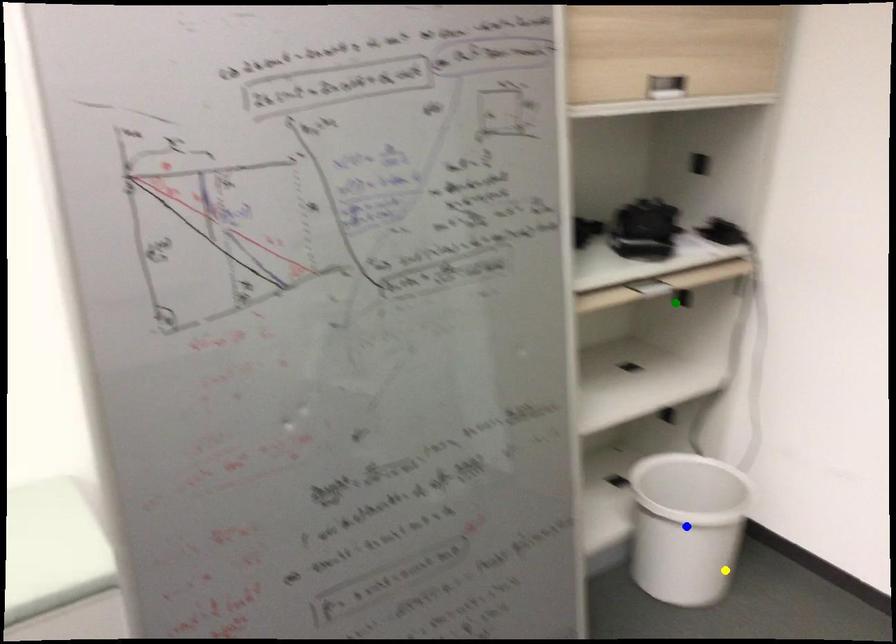
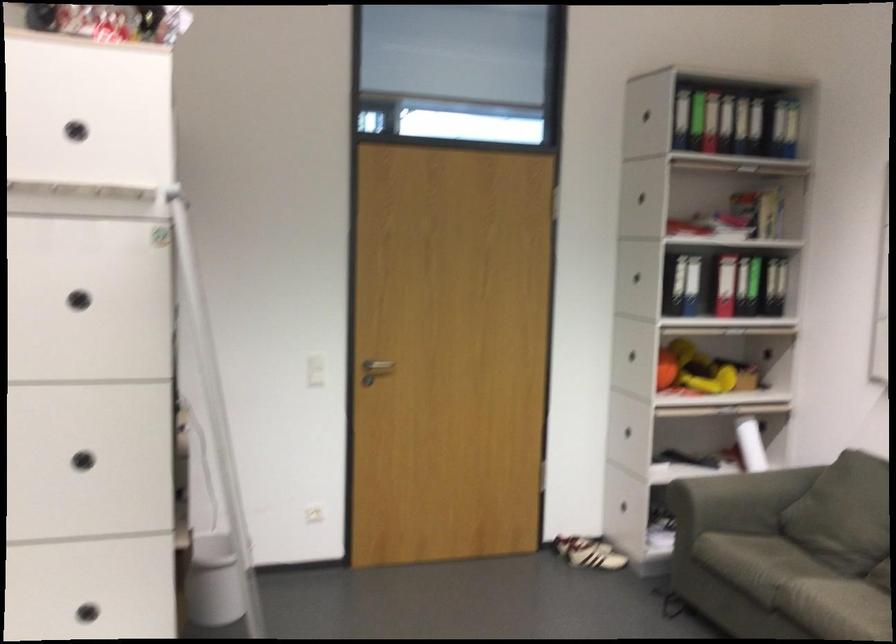
I am providing you with two images of the same scene from different viewpoints. Three points are marked in image1. Which point corresponds to a part or object that is occluded in image2?In image1, three points are marked. Which of them correspond to a part or object that is occluded in image2?Among the three points shown in image1, which one corresponds to a part or object that is no longer visible due to occlusion in image2?

green point, blue point cannot be seen in image2.